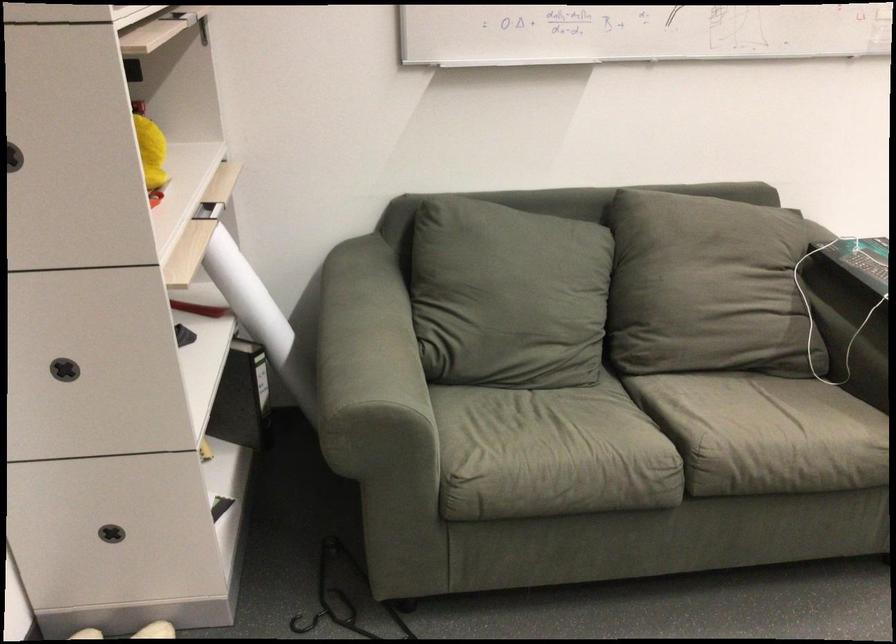
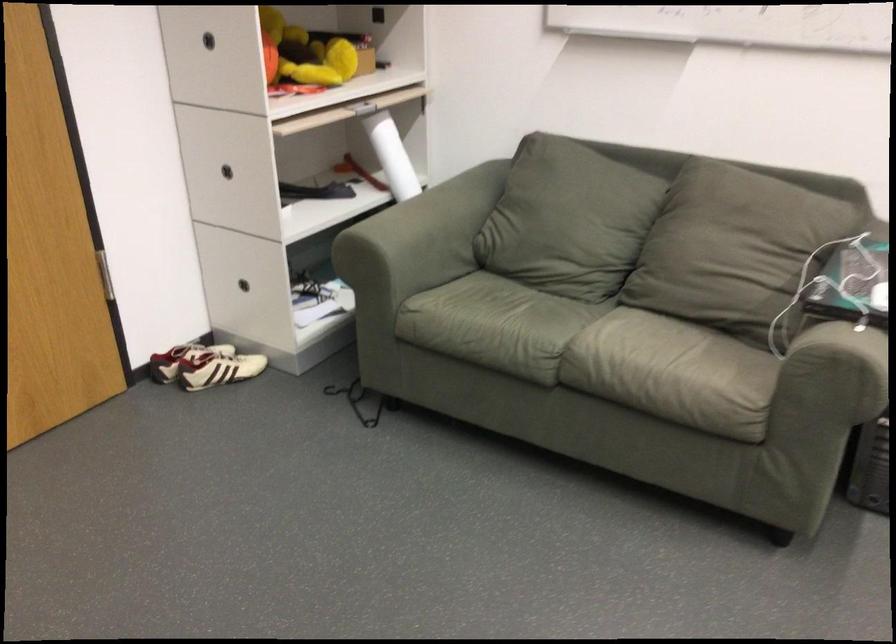
Locate, in the second image, the point that corresponds to point (524, 314) in the first image.

(558, 232)